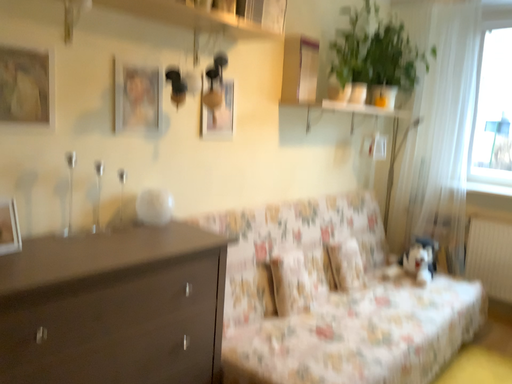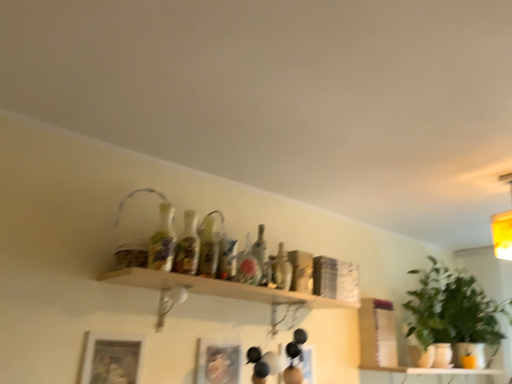
Question: Which way did the camera rotate in the video?

Choices:
 (A) rotated right
 (B) rotated left

Answer: (B)